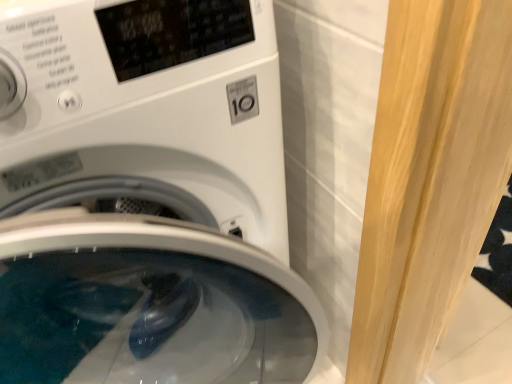
Describe the element at coordinates (147, 197) in the screenshot. The height and width of the screenshot is (384, 512). I see `white glossy washing machine at center` at that location.

I want to click on white glossy washing machine at center, so click(147, 197).

Locate an element on the screen. Image resolution: width=512 pixels, height=384 pixels. white glossy washing machine at center is located at coordinates (147, 197).